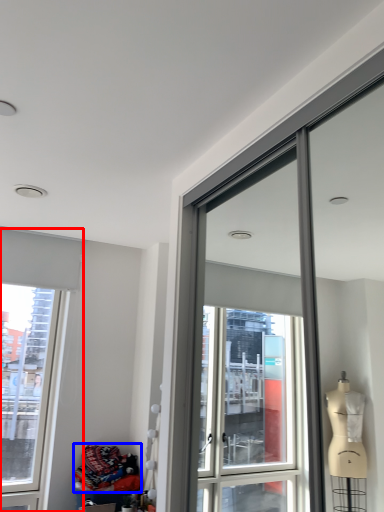
Question: Which of the following is the closest to the observer, window (highlighted by a red box) or material (highlighted by a blue box)?

Choices:
 (A) window
 (B) material

Answer: (B)